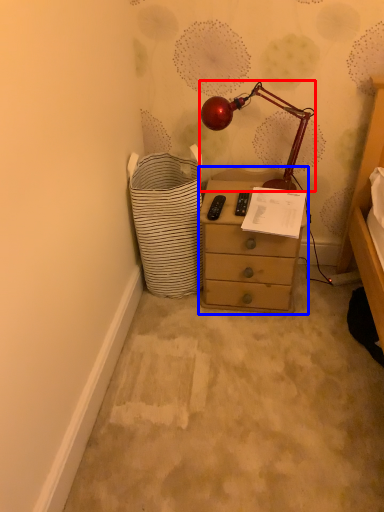
Question: Among these objects, which one is farthest to the camera, lamp (highlighted by a red box) or chest of drawers (highlighted by a blue box)?

Choices:
 (A) lamp
 (B) chest of drawers

Answer: (B)